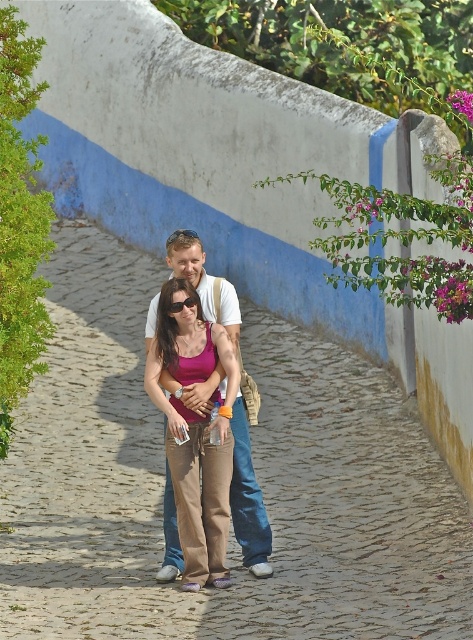
Who is shorter, cobblestone path at center or white cotton shirt at center?

white cotton shirt at center

Is cobblestone path at center shorter than white cotton shirt at center?

No.

Who is more distant from viewer, (126, 580) or (210, 381)?

The point (126, 580) is behind.

The image size is (473, 640). In order to click on cobblestone path at center in this screenshot , I will do `click(257, 477)`.